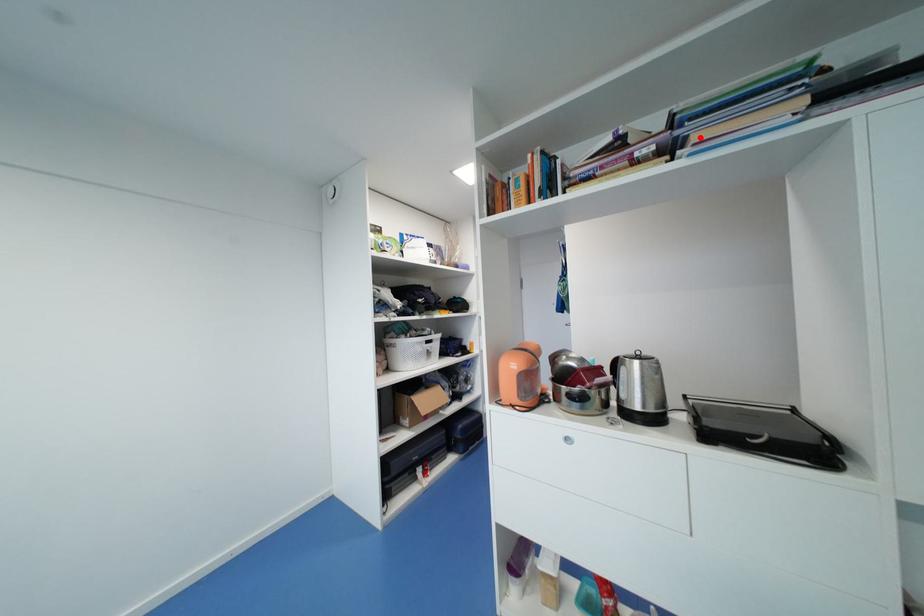
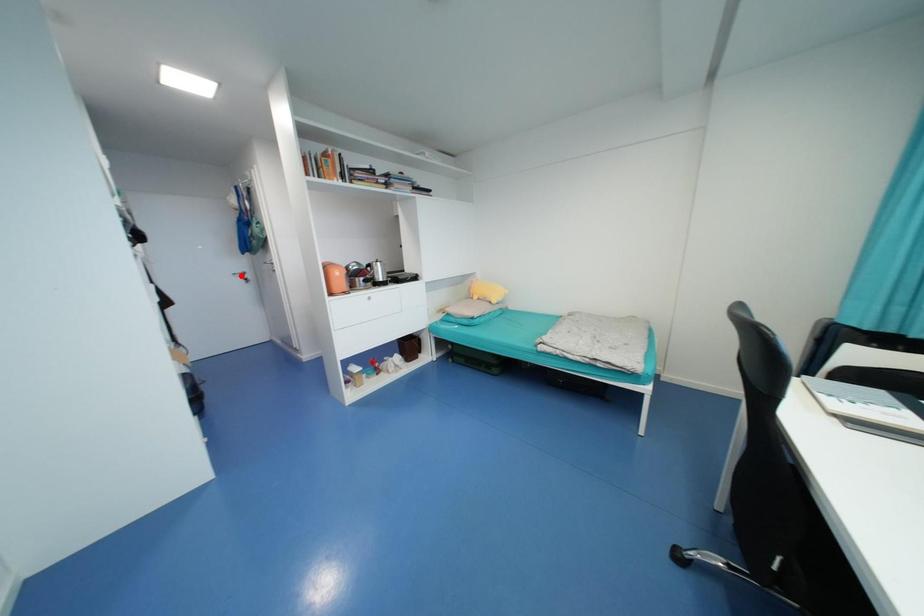
I am providing you with two images of the same scene from different viewpoints. A red point is marked on the first image and another point is marked on the second image. Do the highlighted points in image1 and image2 indicate the same real-world spot?

No